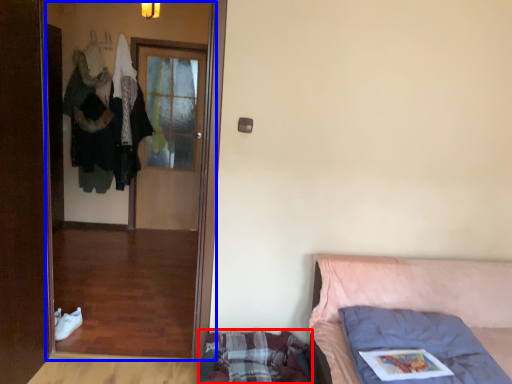
Question: Which of the following is the closest to the observer, mattress (highlighted by a red box) or screen door (highlighted by a blue box)?

Choices:
 (A) mattress
 (B) screen door

Answer: (A)